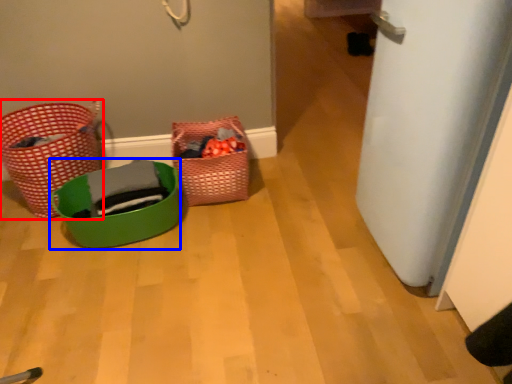
Question: Which object appears closest to the camera in this image, basket (highlighted by a red box) or basket (highlighted by a blue box)?

Choices:
 (A) basket
 (B) basket

Answer: (B)